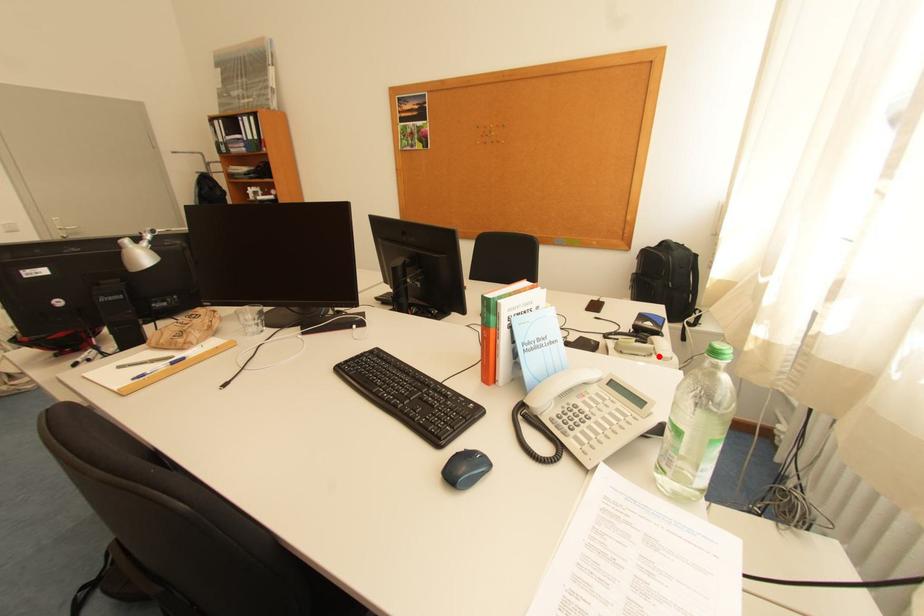
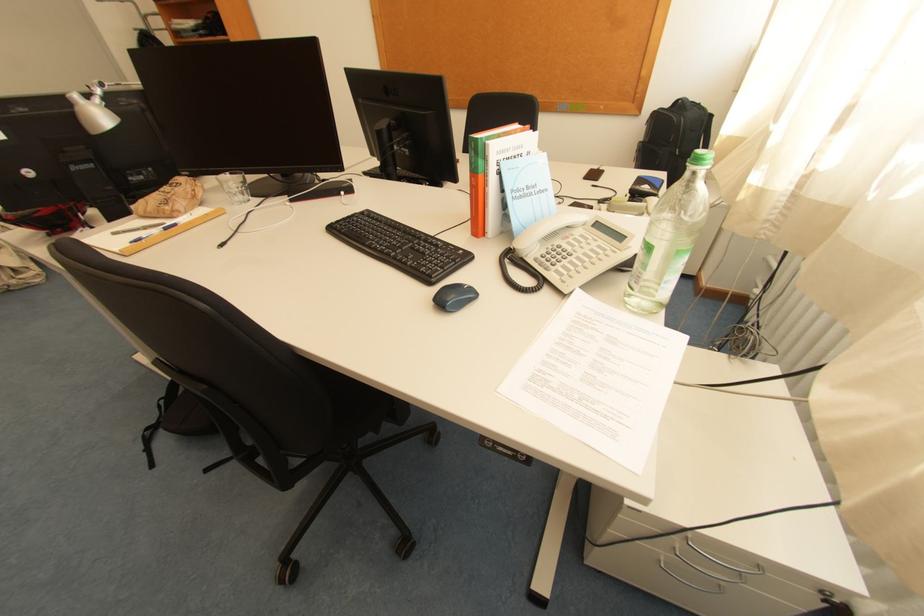
Locate, in the second image, the point that corresponds to the highlighted location in the first image.

(650, 216)